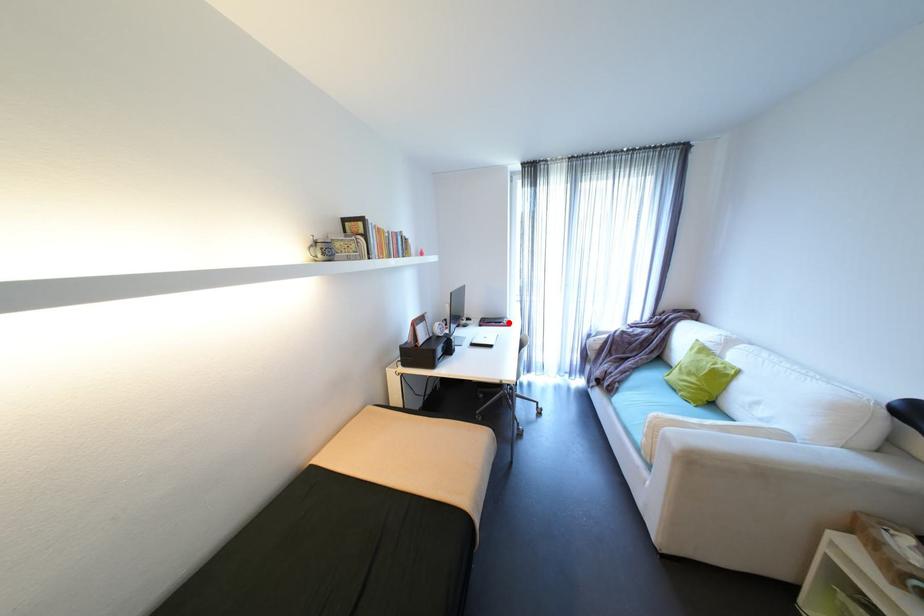
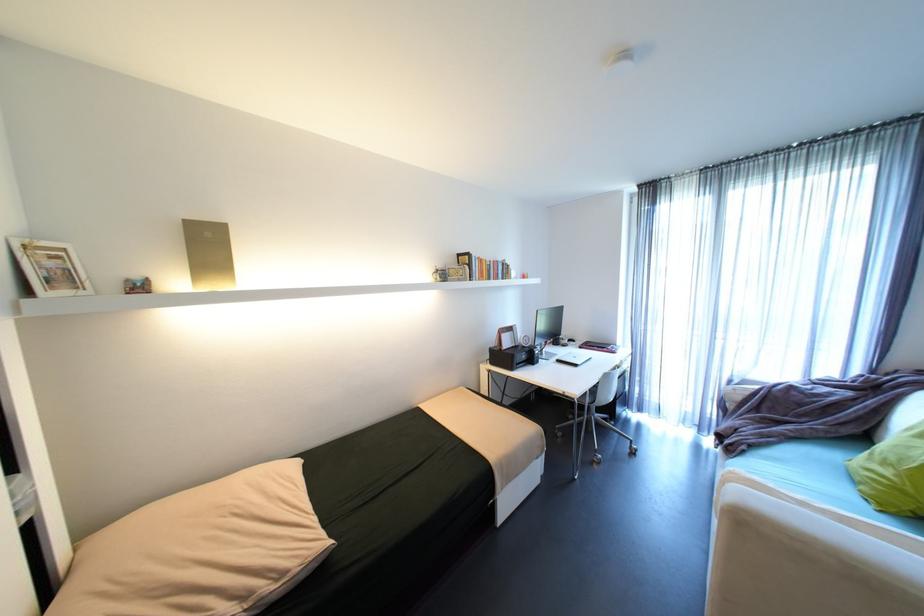
Question: I am providing you with two images of the same scene from different viewpoints. A red point is marked on the first image. At the location where the point appears in image 1, is it still visible in image 2?

Choices:
 (A) Yes
 (B) No

Answer: (A)